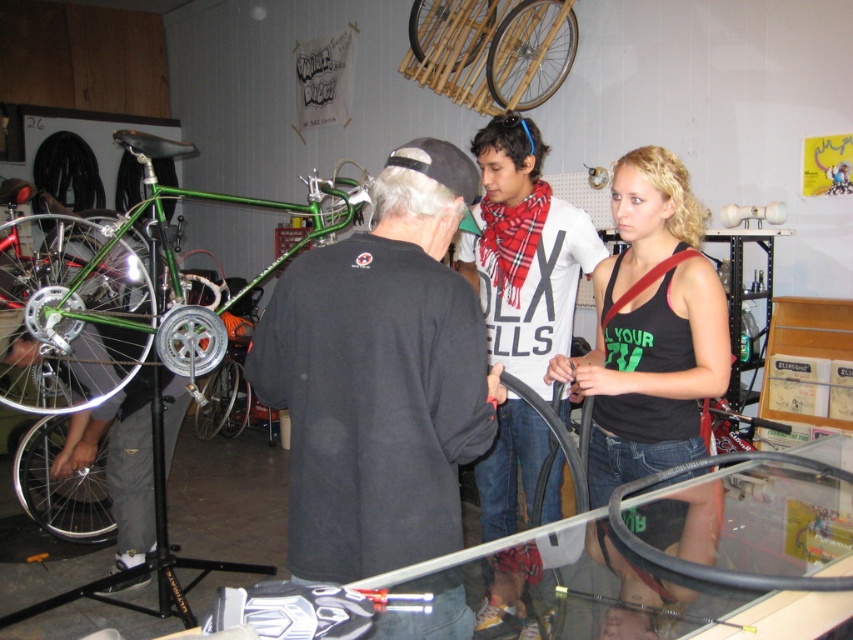
You are standing in the bike shop and want to know which of the two points, point (469,387) or point (679,301), is closer to you. Can you determine this based on their positions?

Point (469,387) is closer to the viewer than point (679,301).

What are the coordinates of the black tank top at center?

The coordinates of the black tank top at center are at point (650, 330).